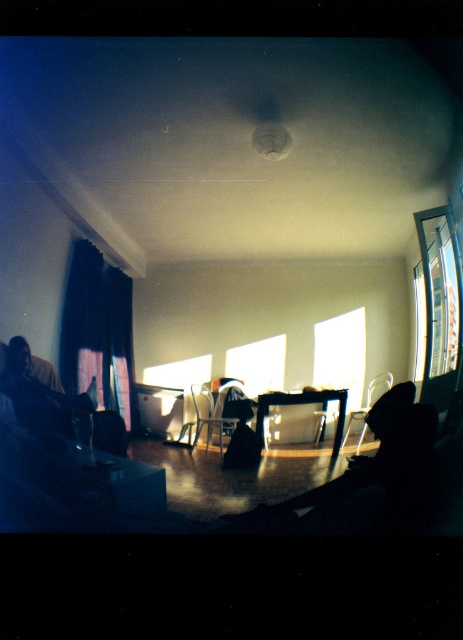
Does silhouette figure at lower right come behind transparent plastic chair at center?

Yes, it is.

At what (x,y) coordinates should I click in order to perform the action: click on silhouette figure at lower right. Please return your answer as a coordinate pair (x, y). Image resolution: width=463 pixels, height=640 pixels. Looking at the image, I should click on (369, 477).

At what (x,y) coordinates should I click in order to perform the action: click on silhouette figure at lower right. Please return your answer as a coordinate pair (x, y). The width and height of the screenshot is (463, 640). Looking at the image, I should click on click(369, 477).

Can you confirm if clear glass window at upper right is bigger than matte black table at center?

Indeed, clear glass window at upper right has a larger size compared to matte black table at center.

Is clear glass window at upper right thinner than matte black table at center?

Indeed, clear glass window at upper right has a lesser width compared to matte black table at center.

Where is `clear glass window at upper right`? This screenshot has width=463, height=640. clear glass window at upper right is located at coordinates (439, 305).

You are a GUI agent. You are given a task and a screenshot of the screen. Output one action in this format:
    pyautogui.click(x=<x>, y=<y>)
    Task: Click on the clear glass window at upper right
    This screenshot has width=463, height=640.
    Given the screenshot: What is the action you would take?
    pyautogui.click(x=439, y=305)

Is point (431, 378) in front of point (364, 413)?

No, (431, 378) is further to viewer.

The height and width of the screenshot is (640, 463). What do you see at coordinates (439, 305) in the screenshot?
I see `clear glass window at upper right` at bounding box center [439, 305].

Measure the distance between clear glass window at upper right and camera.

A distance of 32.05 inches exists between clear glass window at upper right and camera.

You are a GUI agent. You are given a task and a screenshot of the screen. Output one action in this format:
    pyautogui.click(x=<x>, y=<y>)
    Task: Click on the clear glass window at upper right
    This screenshot has width=463, height=640.
    Given the screenshot: What is the action you would take?
    pyautogui.click(x=439, y=305)